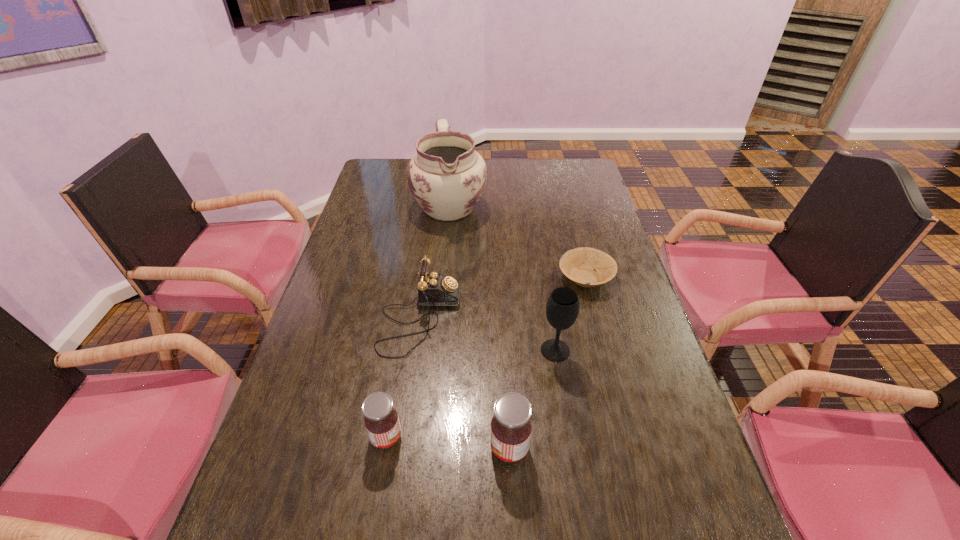
The width and height of the screenshot is (960, 540). Find the location of `vacant space situated on the label side of the left jam`. vacant space situated on the label side of the left jam is located at coordinates (566, 437).

The image size is (960, 540). In order to click on vacant area located 0.120m on the label side of the right jam in this screenshot , I will do `click(432, 448)`.

This screenshot has height=540, width=960. What are the coordinates of `vacant space located 0.080m on the label side of the right jam` in the screenshot? It's located at (451, 448).

In order to click on free space located on the label side of the right jam in this screenshot , I will do `click(327, 448)`.

Where is `vacant space located 0.350m on the dial of the telephone`? vacant space located 0.350m on the dial of the telephone is located at coordinates (588, 318).

The image size is (960, 540). I want to click on vacant space located 0.090m on the spout of the farthest object, so click(x=445, y=249).

The height and width of the screenshot is (540, 960). Find the location of `free space located on the left of the wineglass`. free space located on the left of the wineglass is located at coordinates (418, 350).

This screenshot has width=960, height=540. Find the location of `vacant region located 0.080m on the back of the shortest object`. vacant region located 0.080m on the back of the shortest object is located at coordinates (577, 244).

You are a GUI agent. You are given a task and a screenshot of the screen. Output one action in this format:
    pyautogui.click(x=<x>, y=<y>)
    Task: Click on the object present at the far edge
    
    Given the screenshot: What is the action you would take?
    pyautogui.click(x=446, y=176)

The image size is (960, 540). Identify the location of object at the right edge. (578, 264).